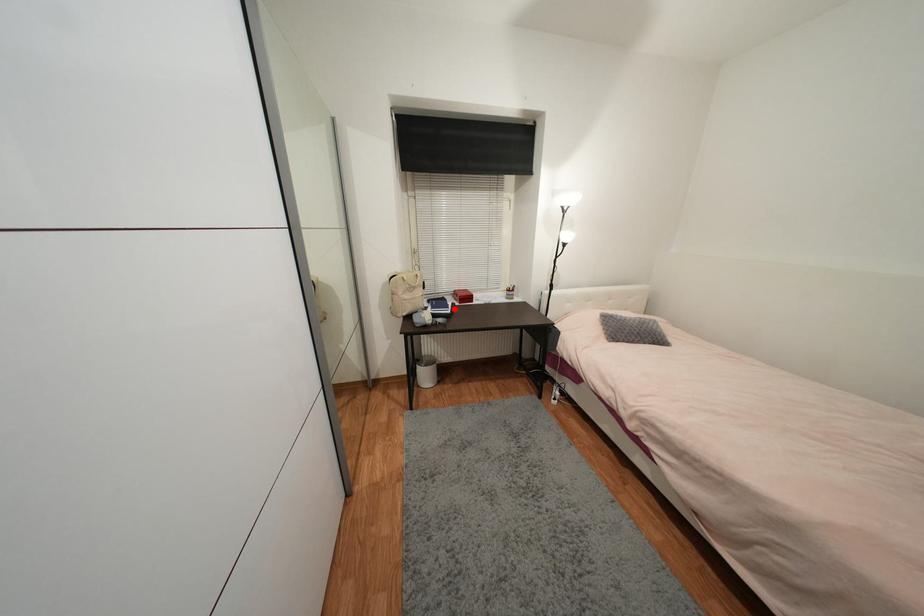
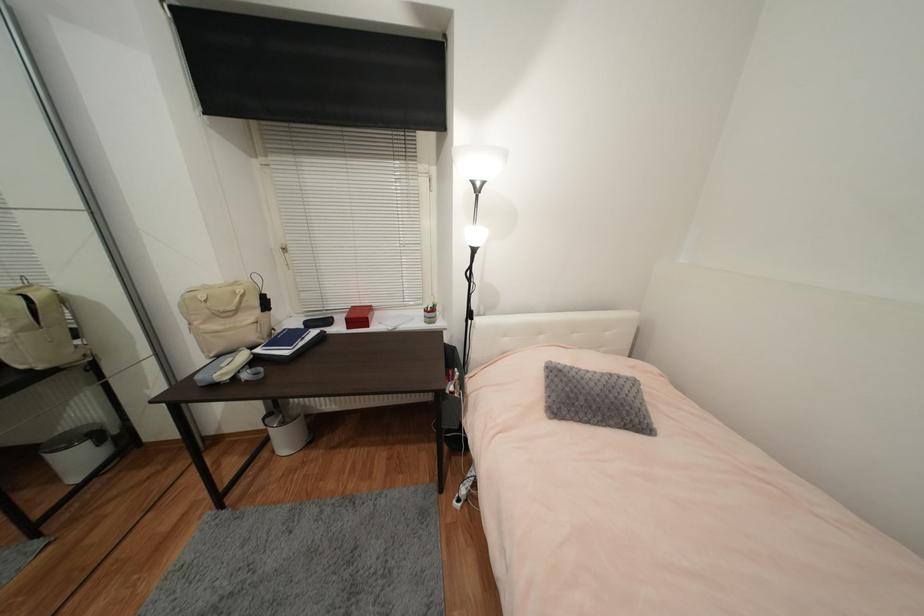
The point at the highlighted location is marked in the first image. Where is the corresponding point in the second image?

(306, 344)